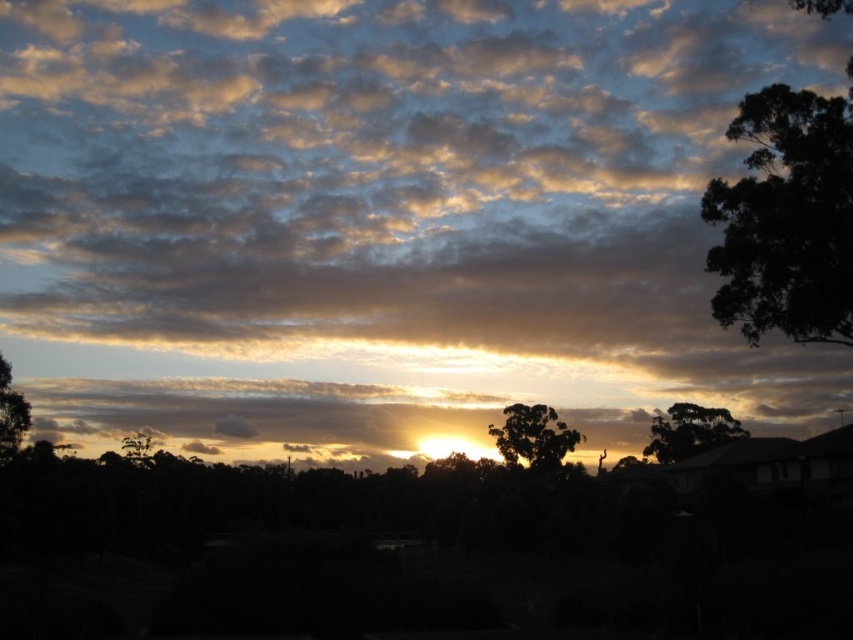
Question: Which object is positioned closest to the cloudy sky at upper center?

Choices:
 (A) green leafy tree at lower left
 (B) silhouette tree at center
 (C) green leafy tree at center-right
 (D) green leafy tree at left

Answer: (A)

Question: Can you confirm if dark green leafy tree at upper right is positioned above silhouette tree at center?

Choices:
 (A) no
 (B) yes

Answer: (B)

Question: Which object is closer to the camera taking this photo?

Choices:
 (A) silhouette tree at center
 (B) cloudy sky at upper center
 (C) green leafy tree at center-right
 (D) green leafy tree at left

Answer: (D)

Question: Which point is closer to the camera?

Choices:
 (A) green leafy tree at left
 (B) green leafy tree at center-right
 (C) dark green leafy tree at upper right

Answer: (C)

Question: Considering the relative positions of cloudy sky at upper center and green leafy tree at left in the image provided, where is cloudy sky at upper center located with respect to green leafy tree at left?

Choices:
 (A) above
 (B) below

Answer: (A)

Question: Observing the image, what is the correct spatial positioning of green leafy tree at center-right in reference to green leafy tree at left?

Choices:
 (A) above
 (B) below

Answer: (B)